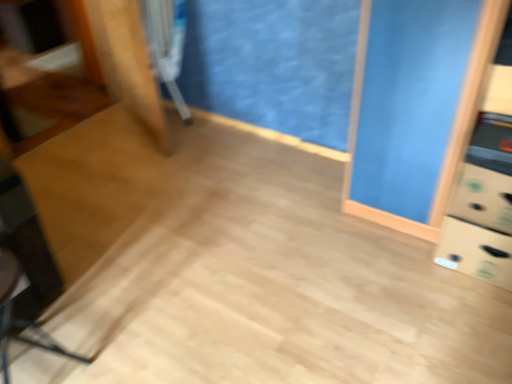
This screenshot has width=512, height=384. In order to click on vacant space to the right of black plastic swivel chair at lower left, which is counted as the 2th swivel chair, starting from the top in this screenshot , I will do `click(120, 347)`.